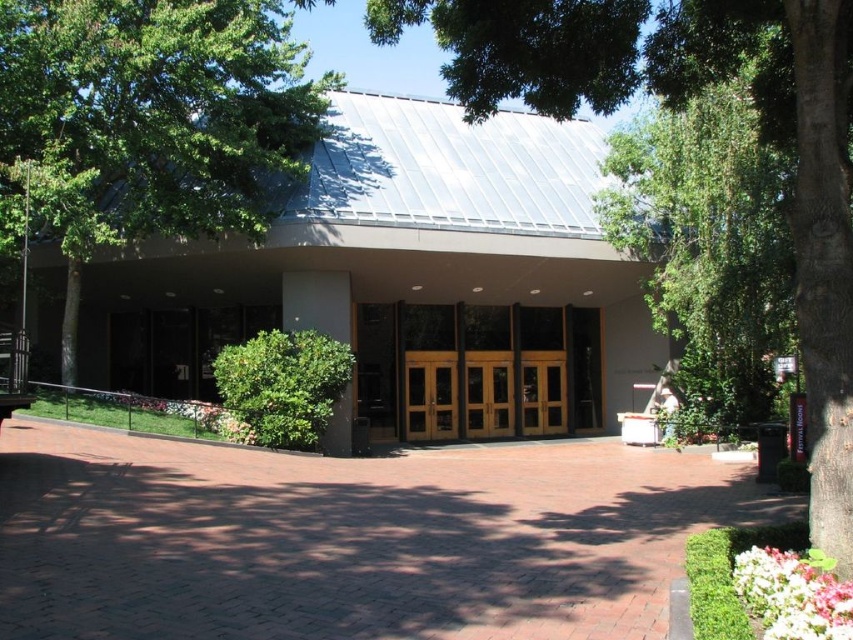
Which is more to the right, green leafy tree at upper left or green leafy tree at center?

green leafy tree at center is more to the right.

Can you confirm if green leafy tree at upper left is wider than green leafy tree at center?

Correct, the width of green leafy tree at upper left exceeds that of green leafy tree at center.

This screenshot has height=640, width=853. What do you see at coordinates (149, 124) in the screenshot?
I see `green leafy tree at upper left` at bounding box center [149, 124].

Identify the location of green leafy tree at upper left. (149, 124).

This screenshot has width=853, height=640. What do you see at coordinates (149, 124) in the screenshot?
I see `green leafy tree at upper left` at bounding box center [149, 124].

Can you confirm if green leafy tree at upper left is positioned above green leafy tree at upper center?

Indeed, green leafy tree at upper left is positioned over green leafy tree at upper center.

Describe the element at coordinates (149, 124) in the screenshot. The width and height of the screenshot is (853, 640). I see `green leafy tree at upper left` at that location.

The width and height of the screenshot is (853, 640). Find the location of `green leafy tree at upper left`. green leafy tree at upper left is located at coordinates (149, 124).

Who is lower down, green leafy tree at center or green leafy tree at upper center?

green leafy tree at center is lower down.

What do you see at coordinates (682, 102) in the screenshot? I see `green leafy tree at center` at bounding box center [682, 102].

Who is more forward, (834, 19) or (640, 200)?

Point (834, 19)

Find the location of `green leafy tree at center`. green leafy tree at center is located at coordinates (682, 102).